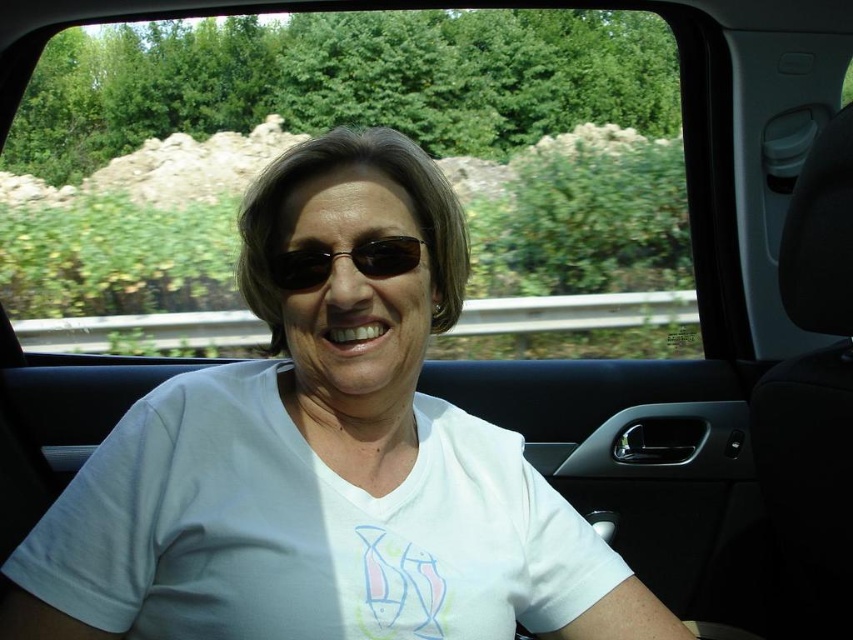
Question: Is transparent glass car window at center to the right of black plastic sunglasses at center from the viewer's perspective?

Choices:
 (A) yes
 (B) no

Answer: (A)

Question: Based on their relative distances, which object is farther from the transparent glass car window at center?

Choices:
 (A) black plastic sunglasses at center
 (B) white cotton shirt at center

Answer: (A)

Question: Does white cotton shirt at center come behind black plastic sunglasses at center?

Choices:
 (A) yes
 (B) no

Answer: (B)

Question: Which object is positioned farthest from the black plastic sunglasses at center?

Choices:
 (A) transparent glass car window at center
 (B) white cotton shirt at center

Answer: (A)

Question: Among these points, which one is farthest from the camera?

Choices:
 (A) (271, 257)
 (B) (474, 234)
 (C) (392, 524)

Answer: (B)

Question: Can you confirm if transparent glass car window at center is positioned to the left of white cotton shirt at center?

Choices:
 (A) yes
 (B) no

Answer: (B)